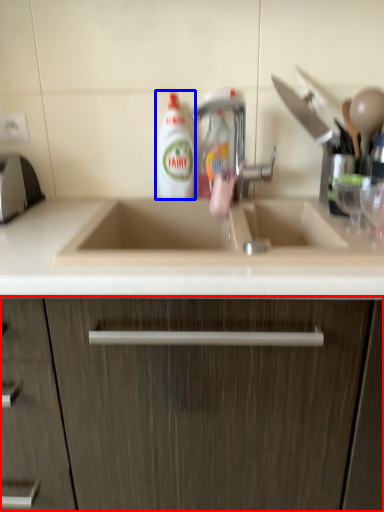
Question: Which object is further to the camera taking this photo, cabinetry (highlighted by a red box) or cleaning product (highlighted by a blue box)?

Choices:
 (A) cabinetry
 (B) cleaning product

Answer: (B)